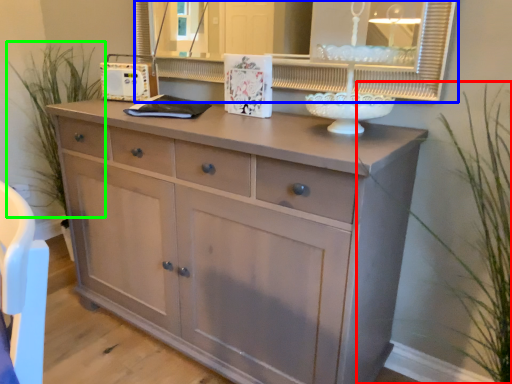
Question: Considering the real-world distances, which object is closest to plant (highlighted by a red box)? medicine cabinet (highlighted by a blue box) or plant (highlighted by a green box).

Choices:
 (A) medicine cabinet
 (B) plant

Answer: (A)